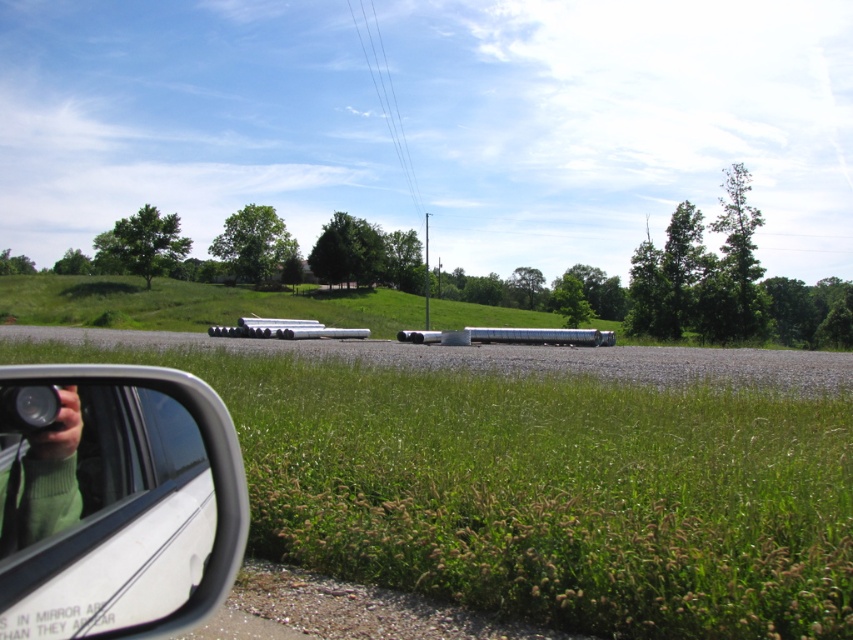
Who is lower down, white glossy rearview mirror at lower left or green sweater at lower left?

green sweater at lower left is below.

Is white glossy rearview mirror at lower left wider than green sweater at lower left?

Correct, the width of white glossy rearview mirror at lower left exceeds that of green sweater at lower left.

Between point (181, 554) and point (45, 456), which one is positioned behind?

Point (181, 554)

You are a GUI agent. You are given a task and a screenshot of the screen. Output one action in this format:
    pyautogui.click(x=<x>, y=<y>)
    Task: Click on the white glossy rearview mirror at lower left
    This screenshot has width=853, height=640.
    Given the screenshot: What is the action you would take?
    pyautogui.click(x=114, y=500)